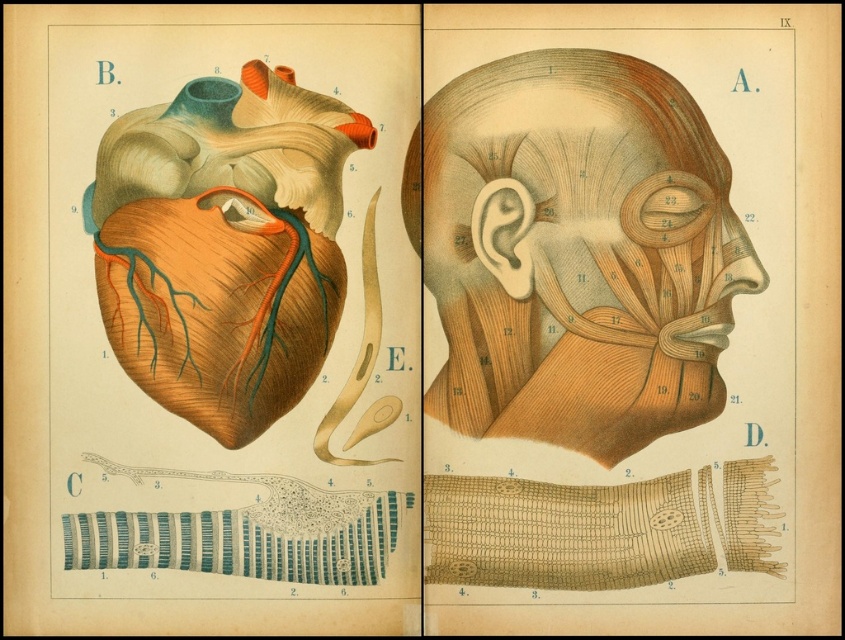
You are a medical student examining an anatomical illustration labeled Section A and Section B. You notice a point labeled with coordinates at point (724,189). If you are standing 1.84 meters away from the illustration, can you comfortably read the labels on the point without needing to move closer?

The point (724,189) is 1.84 meters away from the camera, so yes, you can comfortably read the labels on the point without needing to move closer since the distance is appropriate for reading.

In the anatomical illustration of the human head and neck in profile view, where is the brown textured skin at center located in terms of coordinates?

The brown textured skin at center is located at coordinates point (578, 252).